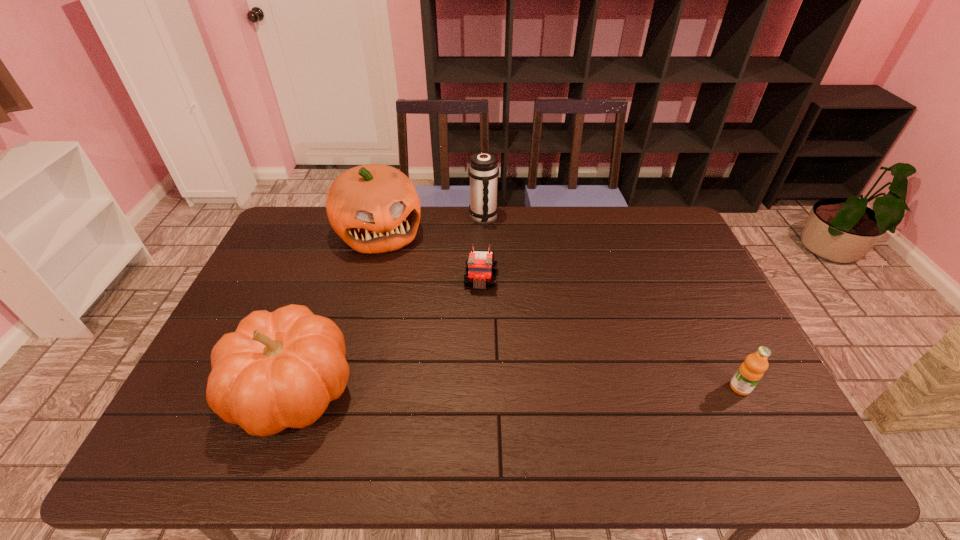
I want to click on the nearer pumpkin, so click(x=280, y=369).

You are a GUI agent. You are given a task and a screenshot of the screen. Output one action in this format:
    pyautogui.click(x=<x>, y=<y>)
    Task: Click on the fourth tallest object
    The width and height of the screenshot is (960, 540).
    Given the screenshot: What is the action you would take?
    pyautogui.click(x=750, y=372)

Locate an element on the screen. The width and height of the screenshot is (960, 540). orange juice is located at coordinates (750, 372).

I want to click on the third farthest object, so click(479, 266).

Image resolution: width=960 pixels, height=540 pixels. I want to click on Lego, so click(479, 266).

The width and height of the screenshot is (960, 540). I want to click on the farther pumpkin, so click(x=374, y=208).

You are a GUI agent. You are given a task and a screenshot of the screen. Output one action in this format:
    pyautogui.click(x=<x>, y=<y>)
    Task: Click on the thermos bottle
    
    Given the screenshot: What is the action you would take?
    click(483, 171)

This screenshot has width=960, height=540. Find the location of `free space located 0.360m on the back of the nearer pumpkin`. free space located 0.360m on the back of the nearer pumpkin is located at coordinates (340, 256).

The width and height of the screenshot is (960, 540). In order to click on free space located on the front-facing side of the third nearest object in this screenshot , I will do `click(477, 328)`.

This screenshot has height=540, width=960. I want to click on vacant space located 0.120m on the front-facing side of the third nearest object, so click(x=477, y=323).